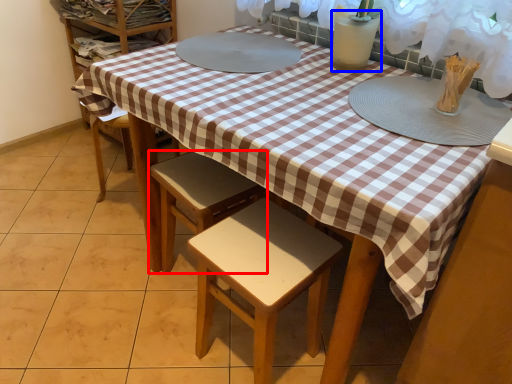
Question: Among these objects, which one is nearest to the camera, stool (highlighted by a red box) or glass vase (highlighted by a blue box)?

Choices:
 (A) stool
 (B) glass vase

Answer: (B)